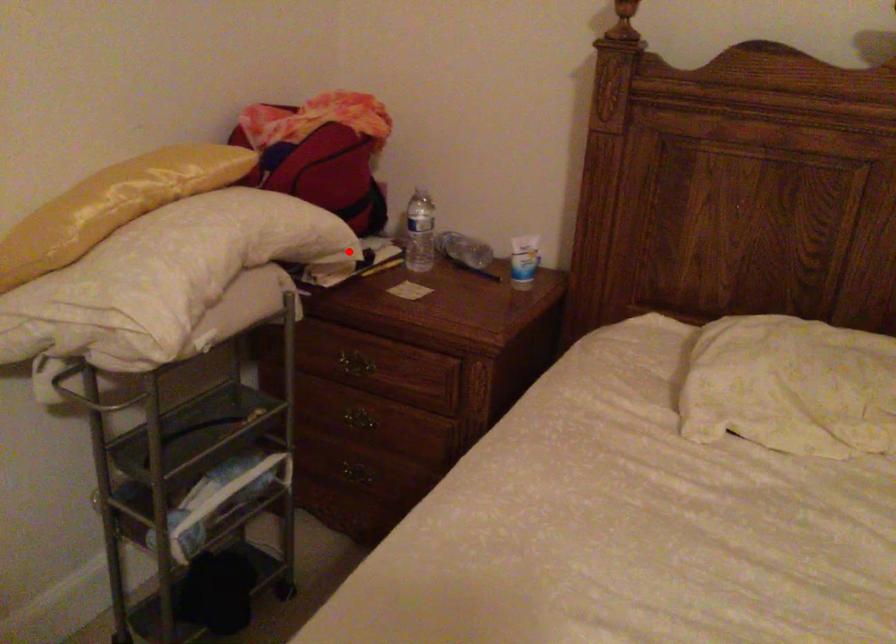
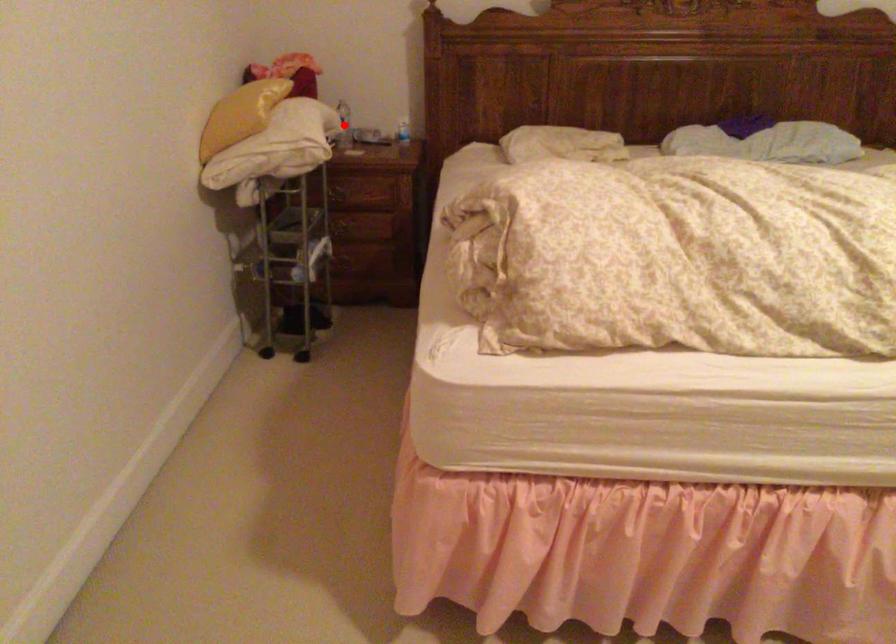
I am providing you with two images of the same scene from different viewpoints. A red point is marked on the first image and another point is marked on the second image. Is the marked point in image1 the same physical position as the marked point in image2?

Yes